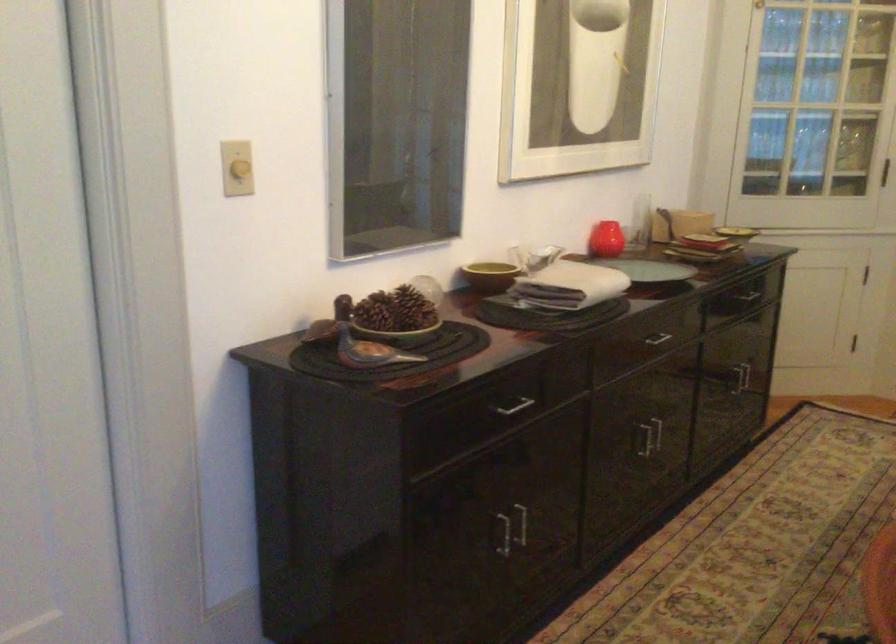
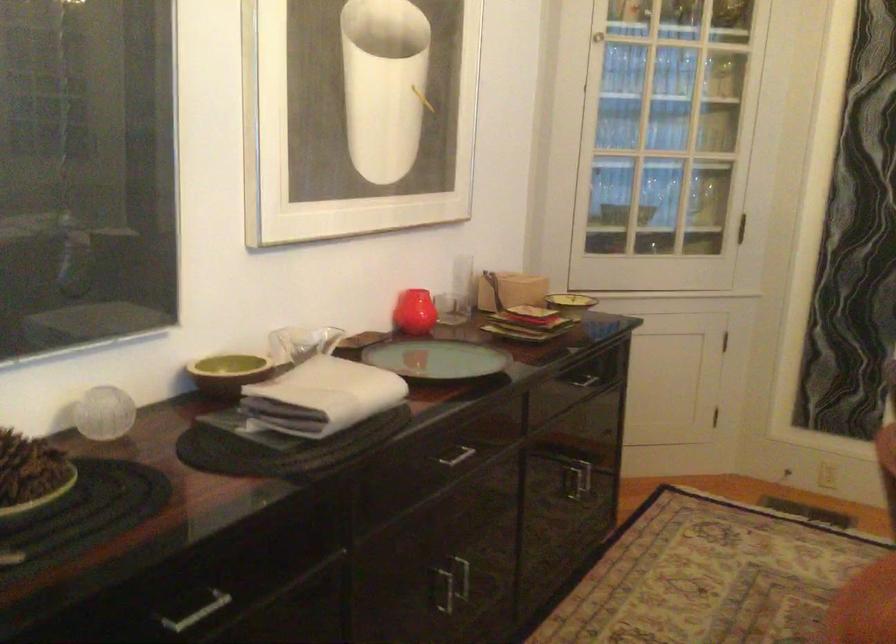
Where in the second image is the point corresponding to (x=648, y=442) from the first image?

(443, 589)